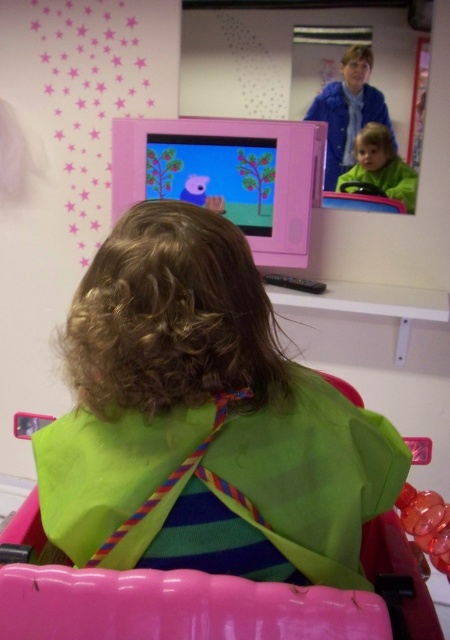
What is the exact coordinate of the green fabric at center in the image?

The green fabric at center is located at point (202, 420).

You are a parent trying to decide which green item to hand to your child first. The green fabric at center is part of the child s bib, and the green matte jacket at center belongs to the person in the mirror. Based on their sizes, which item is taller?

The green fabric at center is taller than the green matte jacket at center, so the bib is taller and should be chosen first.

You are a parent trying to decide whether to place a new toy on the green fabric at center or the green matte jacket at center. Which surface is closer to the left side of the room?

The green fabric at center is to the left of green matte jacket at center, so the green fabric at center is closer to the left side of the room.